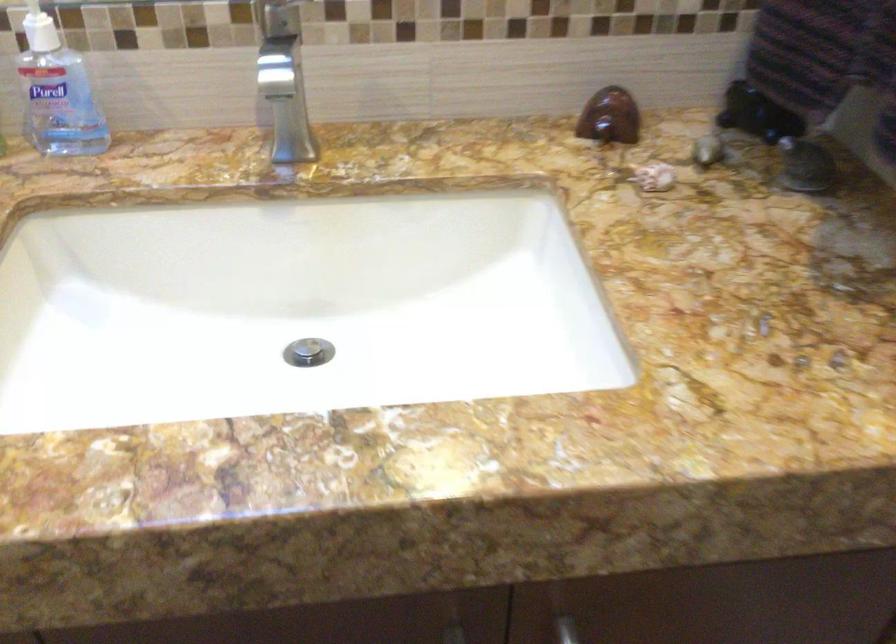
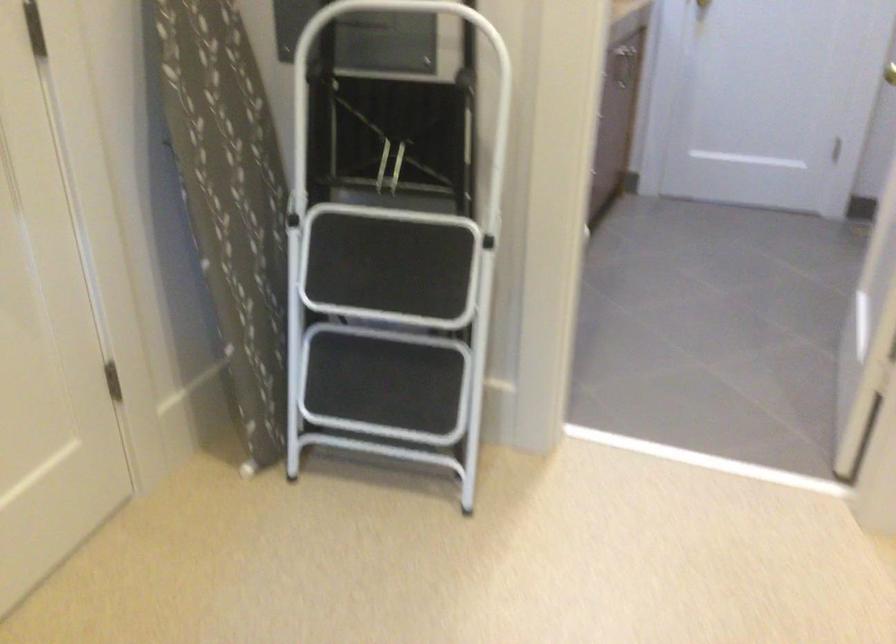
Question: I am providing you with two images of the same scene from different viewpoints. Please identify which objects are invisible in image2.

Choices:
 (A) white magazine file
 (B) patterned ironing board
 (C) black stool step
 (D) sink drain stopper

Answer: (D)